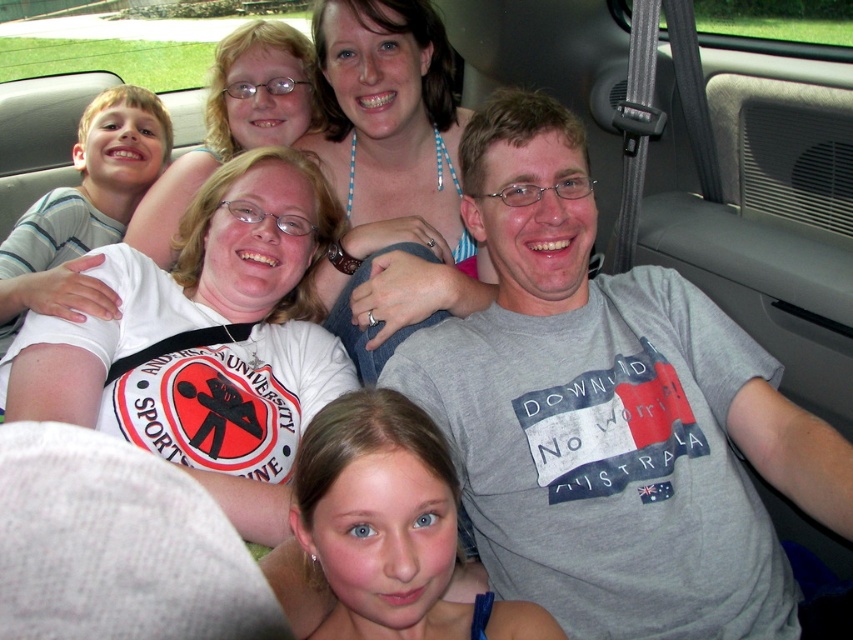
Question: Which of the following is the farthest from the observer?

Choices:
 (A) blue beaded necklace at upper center
 (B) gray cotton t-shirt at center
 (C) blue fabric at lower center
 (D) striped cotton shirt at left

Answer: (A)

Question: Estimate the real-world distances between objects in this image. Which object is closer to the blue fabric at lower center?

Choices:
 (A) gray cotton t-shirt at center
 (B) blue beaded necklace at upper center

Answer: (A)

Question: From the image, what is the correct spatial relationship of blue beaded necklace at upper center in relation to blue fabric at lower center?

Choices:
 (A) right
 (B) left

Answer: (B)

Question: Does blue beaded necklace at upper center have a larger size compared to blue fabric at lower center?

Choices:
 (A) yes
 (B) no

Answer: (A)

Question: Which point is farther to the camera?

Choices:
 (A) (47, 275)
 (B) (492, 252)

Answer: (A)

Question: Does gray cotton t-shirt at center appear under blue fabric at lower center?

Choices:
 (A) yes
 (B) no

Answer: (B)